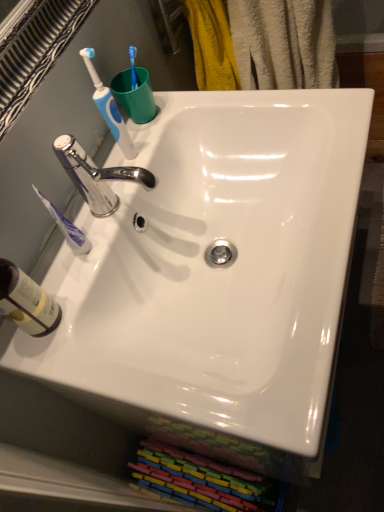
Question: In the image, is translucent plastic bottle at lower left on the left side or the right side of blue plastic toothbrush at upper left, the second toothbrush positioned from the bottom?

Choices:
 (A) right
 (B) left

Answer: (B)

Question: From a real-world perspective, is translucent plastic bottle at lower left physically located above or below blue plastic toothbrush at upper left, which is the first toothbrush from top to bottom?

Choices:
 (A) below
 (B) above

Answer: (A)

Question: Which of these objects is positioned farthest from the chrome metallic faucet at upper left?

Choices:
 (A) translucent plastic bottle at lower left
 (B) blue plastic toothbrush at upper left, the second toothbrush positioned from the bottom
 (C) white plastic toothbrush at left, which is counted as the second toothbrush, starting from the top
 (D) white glossy sink at center
 (E) green plastic cup at upper center

Answer: (A)

Question: Which object is the closest to the blue plastic toothbrush at upper left, which is the first toothbrush from top to bottom?

Choices:
 (A) green plastic cup at upper center
 (B) translucent plastic bottle at lower left
 (C) white glossy sink at center
 (D) white plastic toothbrush at left, which is counted as the second toothbrush, starting from the top
 (E) chrome metallic faucet at upper left

Answer: (A)